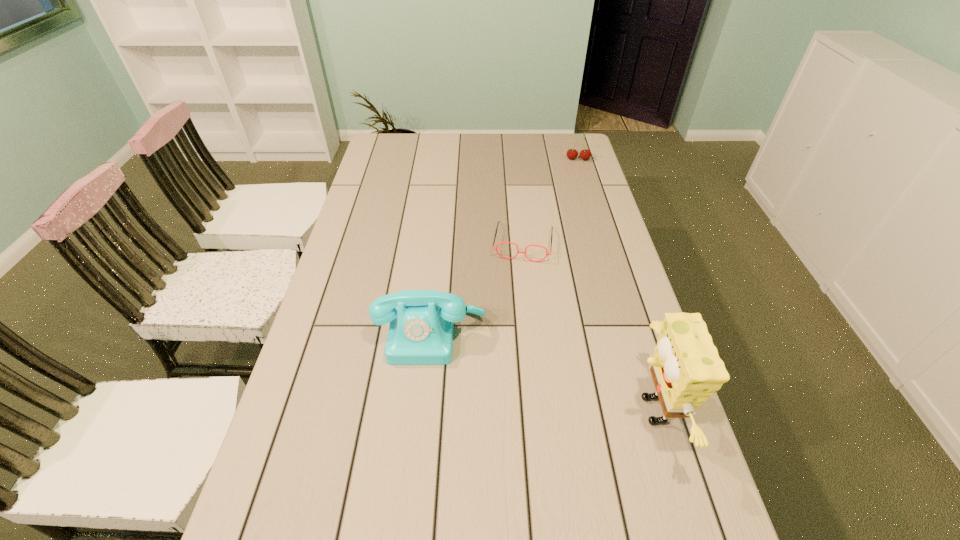
Where is `the leftmost object`? This screenshot has height=540, width=960. the leftmost object is located at coordinates (421, 329).

What are the coordinates of `the third shortest object` in the screenshot? It's located at (421, 329).

Find the location of a particular element. This screenshot has height=540, width=960. sponge is located at coordinates click(x=686, y=369).

Find the location of a particular element. the shortest object is located at coordinates point(518,251).

Where is `spectacles`? Image resolution: width=960 pixels, height=540 pixels. spectacles is located at coordinates (518, 251).

This screenshot has height=540, width=960. In order to click on cherry in this screenshot , I will do `click(585, 154)`.

Where is `the second shortest object`? The height and width of the screenshot is (540, 960). the second shortest object is located at coordinates (585, 154).

At what (x,y) coordinates should I click in order to perform the action: click on free space located 0.350m on the dial of the second tallest object. Please return your answer as a coordinate pair (x, y). Image resolution: width=960 pixels, height=540 pixels. Looking at the image, I should click on (413, 518).

The height and width of the screenshot is (540, 960). In order to click on free space located on the front-facing side of the tallest object in this screenshot , I will do `click(556, 410)`.

This screenshot has width=960, height=540. Find the location of `vacant space located on the front-facing side of the tallest object`. vacant space located on the front-facing side of the tallest object is located at coordinates (525, 410).